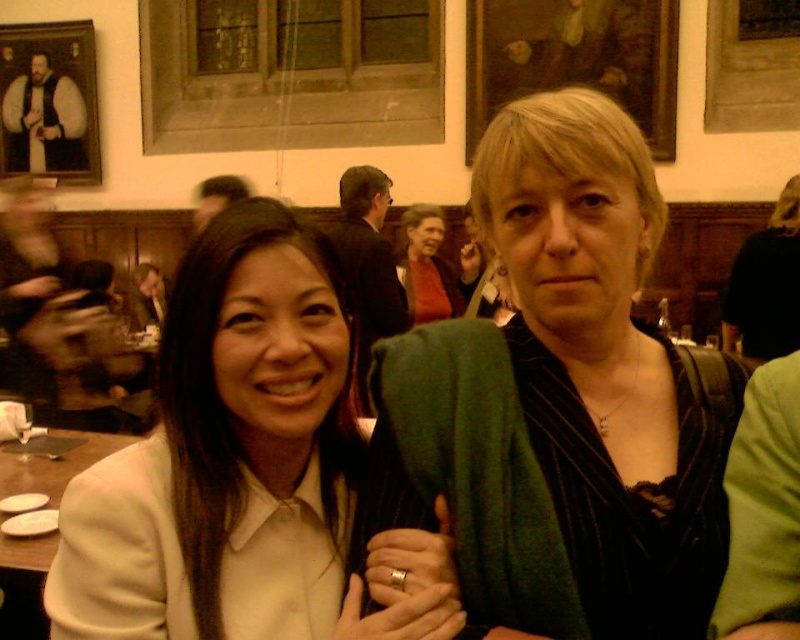
Consider the image. You are a photographer trying to capture a closeup of the matte white blouse at center without including the white glossy plate at lower left in the shot. Given their sizes, is this possible?

The matte white blouse at center is narrower than the white glossy plate at lower left, so it might be challenging to frame the blouse without including the plate if they are positioned closely together in the scene.

You are a photographer trying to capture a closeup of the white glossy plate at lower left without including the matte white blouse at center in the frame. Is this possible given their positions?

The matte white blouse at center is located above the white glossy plate at lower left, so it would be difficult to capture a closeup of the white glossy plate at lower left without including the matte white blouse at center in the frame.

You are at a formal dining setting with two points marked in the scene. The first point is at coordinate point(x=174, y=570) and the second is at point(x=74, y=81). If you were to walk from the first point to the second, would you be moving towards the entrance of the dining area?

The point at(x=174, y=570) is in front of the point at(x=74, y=81). This means that moving from the first point to the second would be moving away from the entrance, as the first point is closer to the entrance than the second.